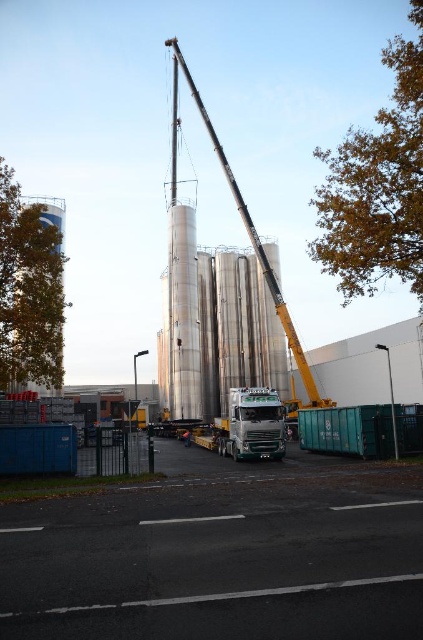
Question: Which object is farther from the camera taking this photo?

Choices:
 (A) green metallic truck at center
 (B) brushed metal silo at left

Answer: (A)

Question: Does green metallic truck at center appear under metallic silver crane at center?

Choices:
 (A) yes
 (B) no

Answer: (A)

Question: In this image, where is metallic silver crane at center located relative to brushed metal silo at left?

Choices:
 (A) right
 (B) left

Answer: (A)

Question: Among these objects, which one is nearest to the camera?

Choices:
 (A) brushed metal silo at left
 (B) metallic silver crane at center
 (C) green metallic truck at center

Answer: (A)

Question: Does green metallic truck at center appear on the left side of brushed metal silo at left?

Choices:
 (A) no
 (B) yes

Answer: (A)

Question: Among these objects, which one is farthest from the camera?

Choices:
 (A) green metallic truck at center
 (B) metallic silver crane at center

Answer: (B)